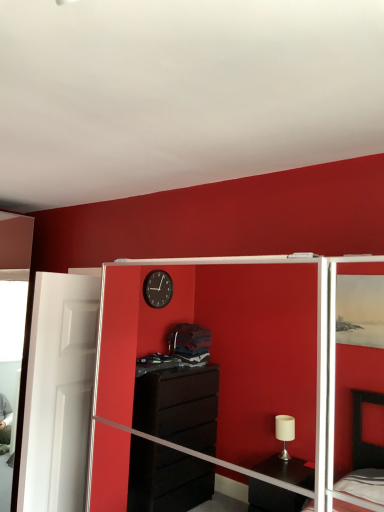
The height and width of the screenshot is (512, 384). Describe the element at coordinates (59, 393) in the screenshot. I see `white glossy door at left` at that location.

Where is `white glossy door at left`? The width and height of the screenshot is (384, 512). white glossy door at left is located at coordinates (59, 393).

Where is `white glossy door at left`? This screenshot has width=384, height=512. white glossy door at left is located at coordinates pos(59,393).